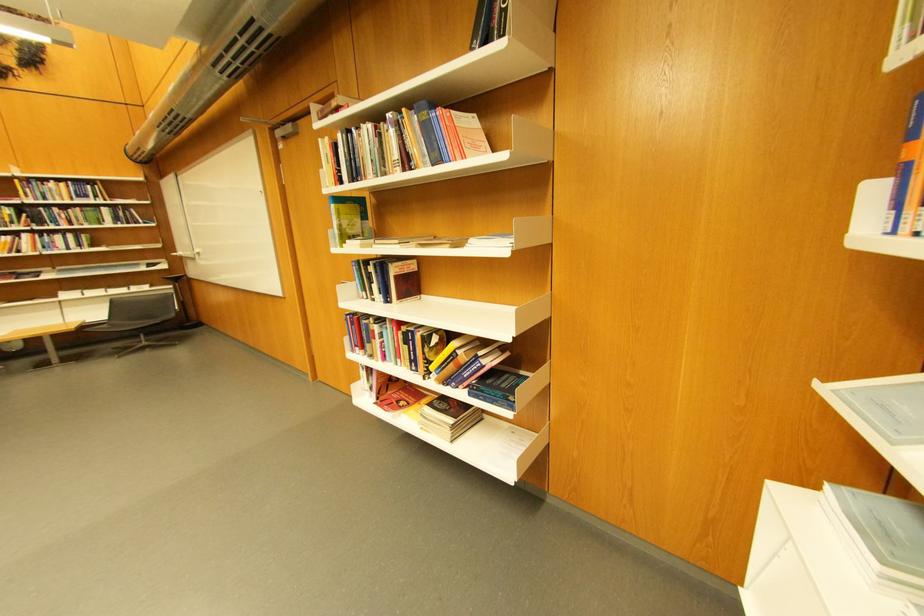
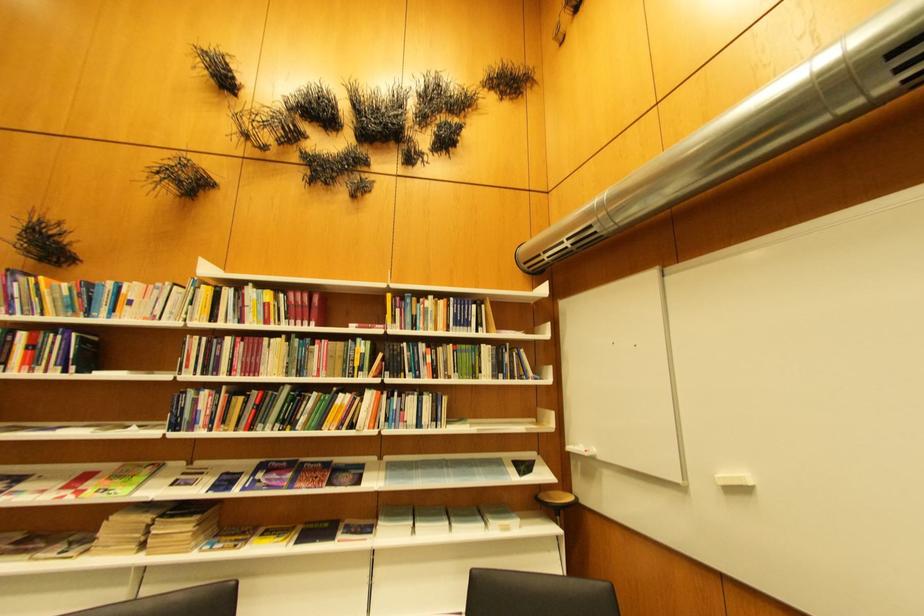
The point at (146, 291) is marked in the first image. Where is the corresponding point in the second image?

(506, 530)